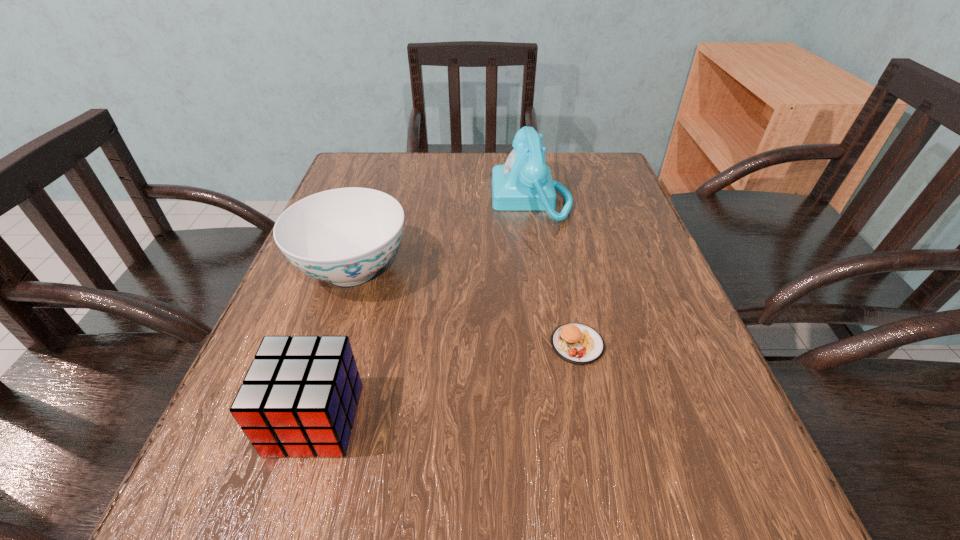
Identify the location of vacant space that's between the tallest object and the third farthest object. The height and width of the screenshot is (540, 960). (554, 272).

Locate an element on the screen. unoccupied position between the cube and the patty is located at coordinates coord(446,382).

Image resolution: width=960 pixels, height=540 pixels. Find the location of `vacant area that lies between the chinaware and the tallest object`. vacant area that lies between the chinaware and the tallest object is located at coordinates (442, 234).

Select which object is the closest to the cube. Please provide its 2D coordinates. Your answer should be formatted as a tuple, i.e. [(x, y)], where the tuple contains the x and y coordinates of a point satisfying the conditions above.

[(344, 236)]

Find the location of a particular element. the third closest object to the farthest object is located at coordinates (299, 397).

This screenshot has height=540, width=960. What are the coordinates of `vacant space that satisfies the following two spatial constraints: 1. on the dial of the third farthest object; 2. on the left side of the tallest object` in the screenshot? It's located at (555, 345).

Identify the location of vacant space that satisfies the following two spatial constraints: 1. on the dial of the tallest object; 2. on the left side of the patty. Image resolution: width=960 pixels, height=540 pixels. coord(555,345).

At what (x,y) coordinates should I click in order to perform the action: click on free space that satisfies the following two spatial constraints: 1. on the dial of the tallest object; 2. on the right side of the patty. Please return your answer as a coordinate pair (x, y). Looking at the image, I should click on (555, 345).

The width and height of the screenshot is (960, 540). I want to click on free space that satisfies the following two spatial constraints: 1. on the front side of the patty; 2. on the right side of the third nearest object, so click(x=327, y=345).

At what (x,y) coordinates should I click in order to perform the action: click on free space in the image that satisfies the following two spatial constraints: 1. on the back side of the patty; 2. on the dial of the tallest object. Please return your answer as a coordinate pair (x, y). Looking at the image, I should click on (547, 198).